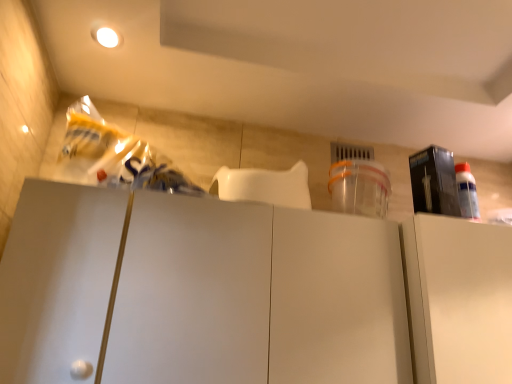
Question: Is white matte cabinet at right, which ranks as the 1th cabinetry in right-to-left order, facing away from white matte cabinet at center, which ranks as the 1th cabinetry in left-to-right order?

Choices:
 (A) no
 (B) yes

Answer: (A)

Question: Does white matte cabinet at right, which is the second cabinetry from left to right, have a greater height compared to white matte cabinet at center, which ranks as the 1th cabinetry in left-to-right order?

Choices:
 (A) yes
 (B) no

Answer: (B)

Question: Is white matte cabinet at right, which ranks as the 1th cabinetry in right-to-left order, aimed at white matte cabinet at center, the 2th cabinetry positioned from the right?

Choices:
 (A) no
 (B) yes

Answer: (A)

Question: From the image's perspective, is white matte cabinet at right, which is the second cabinetry from left to right, on white matte cabinet at center, which ranks as the 1th cabinetry in left-to-right order?

Choices:
 (A) no
 (B) yes

Answer: (A)

Question: From a real-world perspective, does white matte cabinet at right, which ranks as the 1th cabinetry in right-to-left order, sit lower than white matte cabinet at center, which ranks as the 1th cabinetry in left-to-right order?

Choices:
 (A) no
 (B) yes

Answer: (A)

Question: From a real-world perspective, is white matte cabinet at center, the 2th cabinetry positioned from the right, above or below matte black box at upper right?

Choices:
 (A) above
 (B) below

Answer: (B)

Question: Is point (279, 208) closer or farther from the camera than point (454, 198)?

Choices:
 (A) closer
 (B) farther

Answer: (A)

Question: Is white matte cabinet at center, which ranks as the 1th cabinetry in left-to-right order, to the left or to the right of matte black box at upper right in the image?

Choices:
 (A) left
 (B) right

Answer: (A)

Question: Is white matte cabinet at center, the 2th cabinetry positioned from the right, wider or thinner than matte black box at upper right?

Choices:
 (A) thin
 (B) wide

Answer: (B)

Question: Would you say matte black box at upper right is inside or outside white matte cabinet at center, which ranks as the 1th cabinetry in left-to-right order?

Choices:
 (A) inside
 (B) outside

Answer: (B)

Question: Is point (431, 173) positioned closer to the camera than point (244, 203)?

Choices:
 (A) farther
 (B) closer

Answer: (A)

Question: Is matte black box at upper right to the left or to the right of white matte cabinet at center, which ranks as the 1th cabinetry in left-to-right order, in the image?

Choices:
 (A) right
 (B) left

Answer: (A)

Question: Is matte black box at upper right bigger or smaller than white matte cabinet at center, which ranks as the 1th cabinetry in left-to-right order?

Choices:
 (A) big
 (B) small

Answer: (B)

Question: Is matte black box at upper right in front of or behind white matte cabinet at right, which ranks as the 1th cabinetry in right-to-left order, in the image?

Choices:
 (A) behind
 (B) front

Answer: (A)

Question: Would you say matte black box at upper right is to the left or to the right of white matte cabinet at right, which ranks as the 1th cabinetry in right-to-left order, in the picture?

Choices:
 (A) left
 (B) right

Answer: (A)